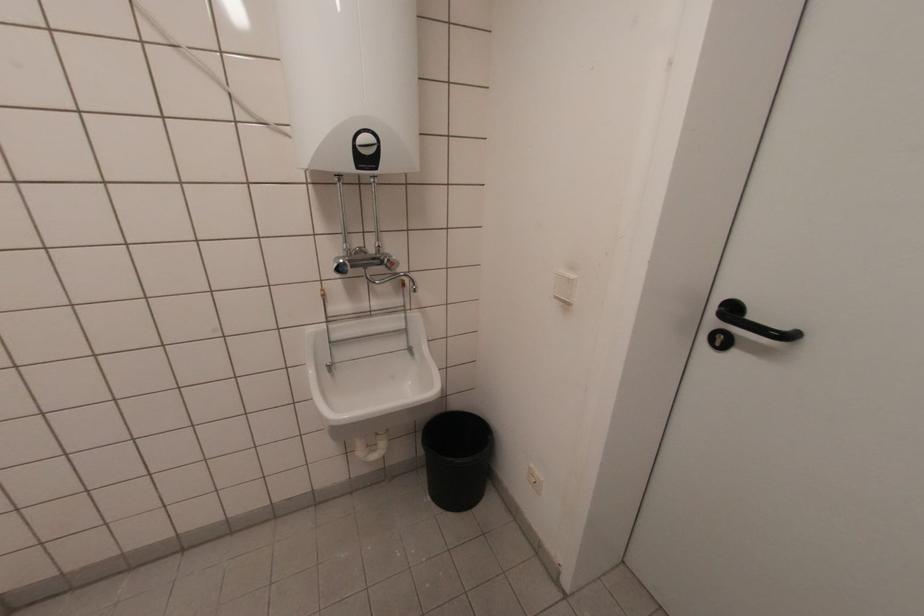
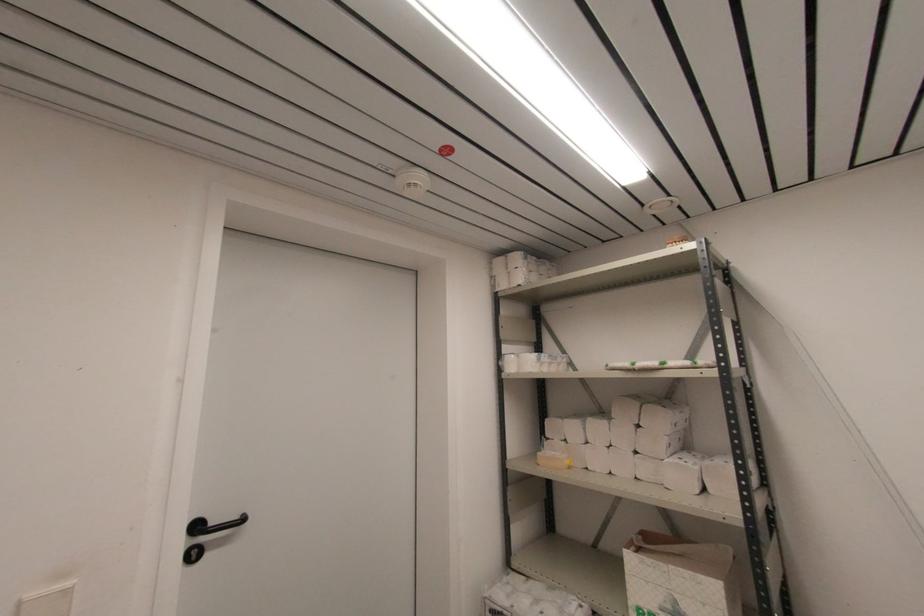
Question: The images are taken continuously from a first-person perspective. In which direction is your viewpoint rotating?

Choices:
 (A) Left
 (B) Right
 (C) Up
 (D) Down

Answer: (B)